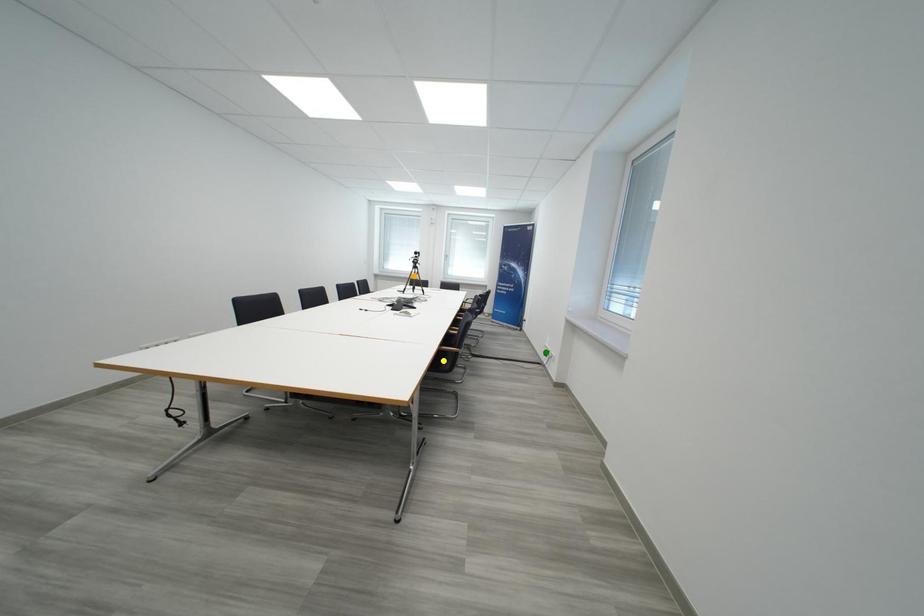
Order these from farthest to nearest:
A) yellow point
B) orange point
C) green point

orange point → green point → yellow point